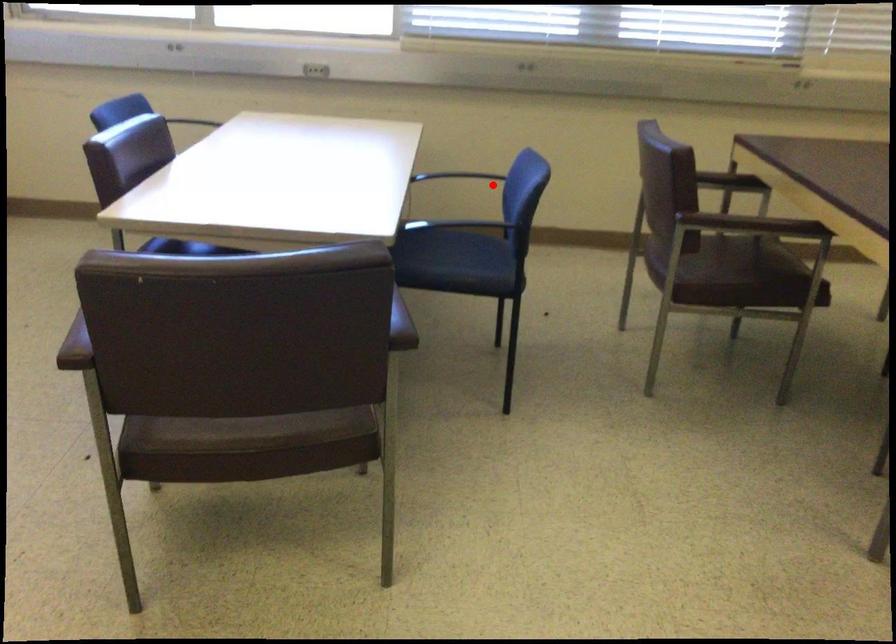
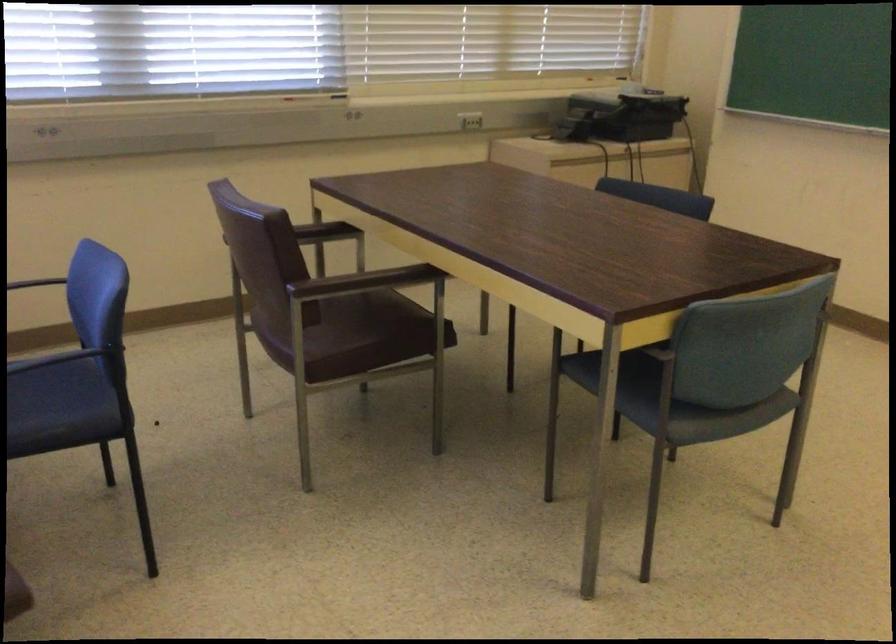
In the second image, find the point that corresponds to the highlighted location in the first image.

(39, 283)